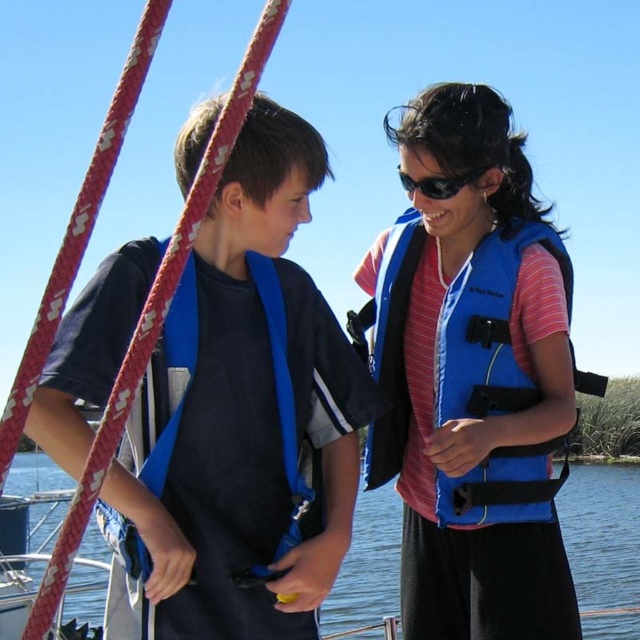
Question: Estimate the real-world distances between objects in this image. Which object is closer to the blue water at center?

Choices:
 (A) blue fabric life jacket at center
 (B) blue plastic goggles at upper center
 (C) blue fabric life jacket at left

Answer: (C)

Question: Where is blue fabric life jacket at center located in relation to blue plastic goggles at upper center in the image?

Choices:
 (A) right
 (B) left

Answer: (A)

Question: Which point is closer to the camera taking this photo?

Choices:
 (A) (410, 220)
 (B) (84, 616)

Answer: (A)

Question: Is blue water at center wider than blue plastic goggles at upper center?

Choices:
 (A) yes
 (B) no

Answer: (A)

Question: Does blue fabric life vest at left lie in front of blue water at center?

Choices:
 (A) yes
 (B) no

Answer: (A)

Question: Which point is closer to the camera taking this photo?

Choices:
 (A) (336, 460)
 (B) (100, 508)
 (C) (456, 179)

Answer: (B)